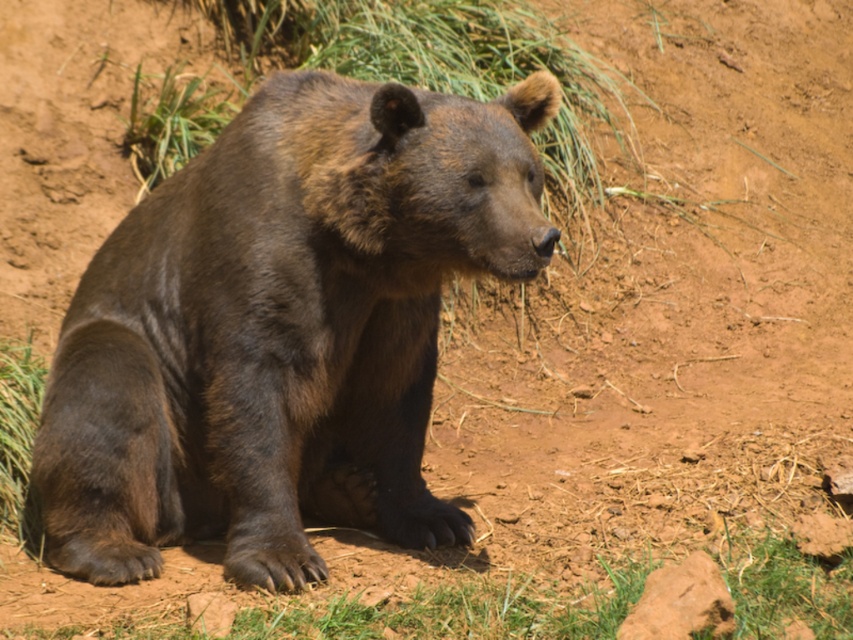
Question: Which point is farther to the camera?

Choices:
 (A) (398, 186)
 (B) (190, 93)
 (C) (368, 609)
 (D) (22, 480)

Answer: (B)

Question: In this image, where is brown furry bear at center located relative to green grass at upper left?

Choices:
 (A) above
 (B) below

Answer: (B)

Question: Which is farther from the green grass at lower left?

Choices:
 (A) brown furry bear at center
 (B) green grass at upper left

Answer: (B)

Question: Does brown furry bear at center have a larger size compared to green grass at lower center?

Choices:
 (A) yes
 (B) no

Answer: (A)

Question: Can you confirm if green grass at lower center is wider than green grass at lower left?

Choices:
 (A) yes
 (B) no

Answer: (A)

Question: Which object is farther from the camera taking this photo?

Choices:
 (A) brown furry bear at center
 (B) green grass at lower left

Answer: (B)